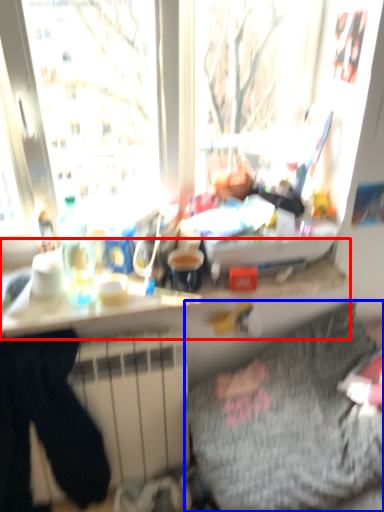
Question: Which point is further to the camera, counter top (highlighted by a red box) or bedding (highlighted by a blue box)?

Choices:
 (A) counter top
 (B) bedding

Answer: (A)